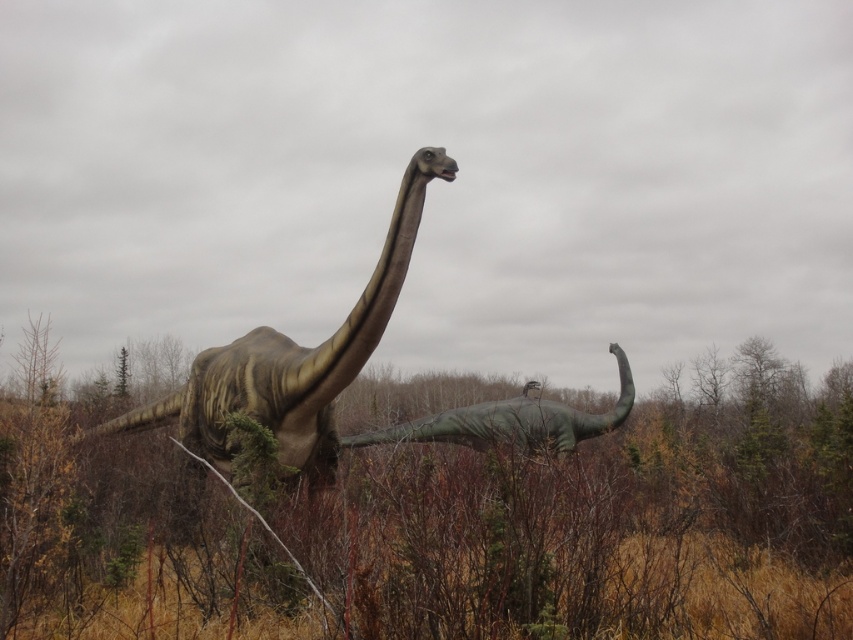
You are standing in the outdoor area where the dinosaurs are displayed. You need to place a new informational plaque about the green matte foliage at center. Where should you place it?

The green matte foliage at center is located at point (595,524), so you should place the plaque near that coordinate.